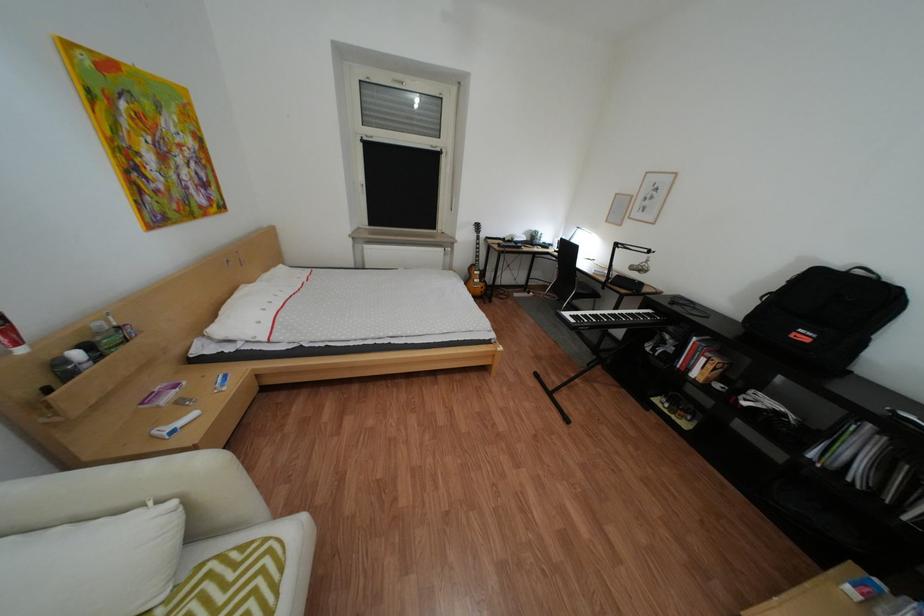
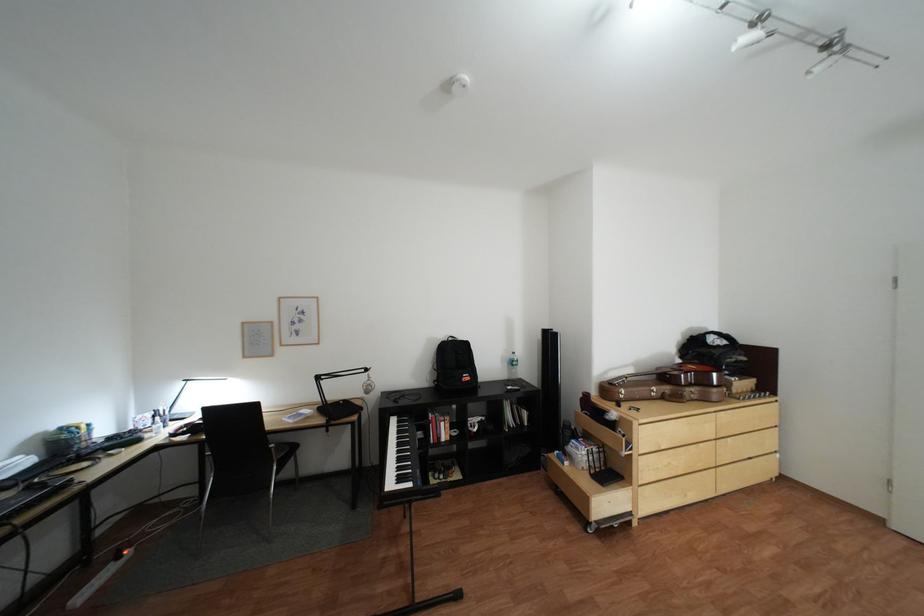
Locate, in the second image, the point that corresponds to [874,273] in the first image.

(466, 339)